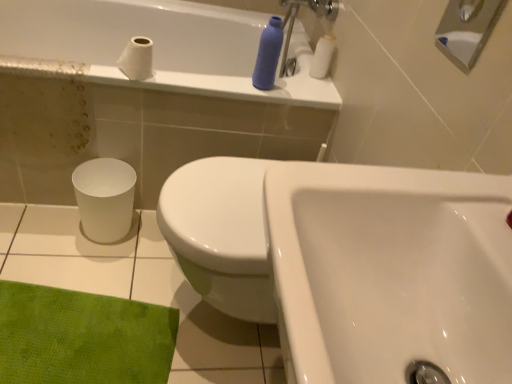
Question: From a real-world perspective, is white ceramic tile at lower left physically below matte plastic bottle at upper center?

Choices:
 (A) no
 (B) yes

Answer: (B)

Question: Is the surface of white ceramic tile at lower left in direct contact with matte plastic bottle at upper center?

Choices:
 (A) yes
 (B) no

Answer: (B)

Question: Is white ceramic tile at lower left at the left side of matte plastic bottle at upper center?

Choices:
 (A) no
 (B) yes

Answer: (B)

Question: From the image's perspective, is white ceramic tile at lower left located above matte plastic bottle at upper center?

Choices:
 (A) yes
 (B) no

Answer: (B)

Question: Does white ceramic tile at lower left lie in front of matte plastic bottle at upper center?

Choices:
 (A) no
 (B) yes

Answer: (B)

Question: Would you say white matte toilet paper at upper right, which ranks as the 2th toilet paper in left-to-right order, is to the left or to the right of brushed metal shower at upper right in the picture?

Choices:
 (A) right
 (B) left

Answer: (B)

Question: In terms of size, does white matte toilet paper at upper right, the first toilet paper viewed from the right, appear bigger or smaller than brushed metal shower at upper right?

Choices:
 (A) small
 (B) big

Answer: (B)

Question: In the image, is white matte toilet paper at upper right, which is the 1th toilet paper from back to front, positioned in front of or behind brushed metal shower at upper right?

Choices:
 (A) front
 (B) behind

Answer: (B)

Question: Would you say white matte toilet paper at upper right, the first toilet paper viewed from the right, is inside or outside brushed metal shower at upper right?

Choices:
 (A) outside
 (B) inside

Answer: (A)

Question: In the image, is brushed metal shower at upper right on the left side or the right side of white glossy sink at center?

Choices:
 (A) right
 (B) left

Answer: (A)

Question: Considering the positions of brushed metal shower at upper right and white glossy sink at center in the image, is brushed metal shower at upper right taller or shorter than white glossy sink at center?

Choices:
 (A) tall
 (B) short

Answer: (B)

Question: Looking at their shapes, would you say brushed metal shower at upper right is wider or thinner than white glossy sink at center?

Choices:
 (A) thin
 (B) wide

Answer: (A)

Question: From a real-world perspective, is brushed metal shower at upper right physically located above or below white glossy sink at center?

Choices:
 (A) above
 (B) below

Answer: (A)

Question: From the image's perspective, is white ceramic tile at lower left positioned above or below white matte toilet paper at upper left, arranged as the second toilet paper when viewed from the back?

Choices:
 (A) above
 (B) below

Answer: (B)

Question: Is white ceramic tile at lower left inside the boundaries of white matte toilet paper at upper left, marked as the 2th toilet paper in a right-to-left arrangement, or outside?

Choices:
 (A) inside
 (B) outside

Answer: (B)